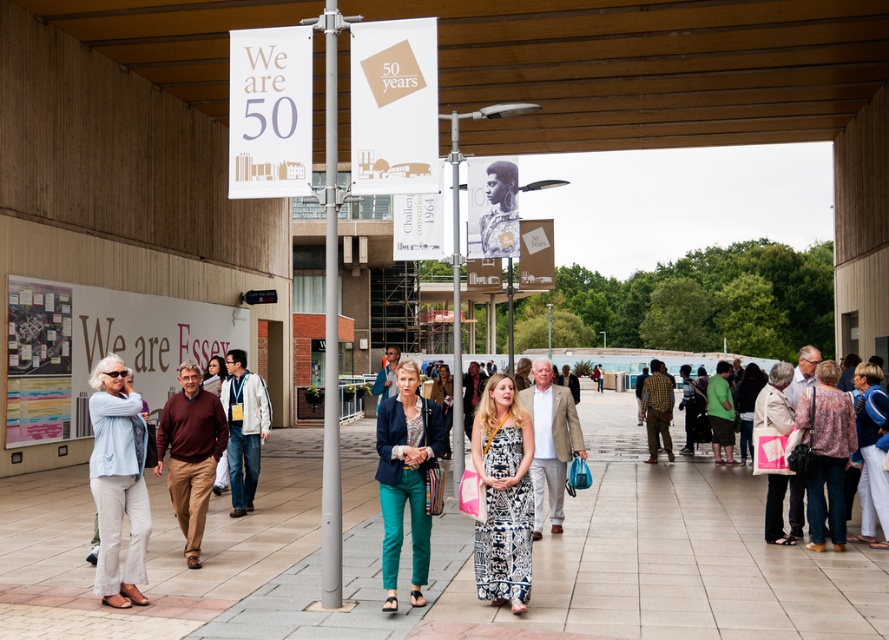
Between light blue denim jacket at lower left and maroon sweater at center, which one appears on the left side from the viewer's perspective?

From the viewer's perspective, light blue denim jacket at lower left appears more on the left side.

Does light blue denim jacket at lower left appear under maroon sweater at center?

Incorrect, light blue denim jacket at lower left is not positioned below maroon sweater at center.

Where is `light blue denim jacket at lower left`? Image resolution: width=889 pixels, height=640 pixels. light blue denim jacket at lower left is located at coordinates (118, 481).

Measure the distance between smooth concrete pavement at center and silver metallic pole at center.

A distance of 11.01 feet exists between smooth concrete pavement at center and silver metallic pole at center.

Who is positioned more to the right, smooth concrete pavement at center or silver metallic pole at center?

Positioned to the right is smooth concrete pavement at center.

Measure the distance between point (x=453, y=618) and camera.

They are 7.23 meters apart.

Locate an element on the screen. Image resolution: width=889 pixels, height=640 pixels. smooth concrete pavement at center is located at coordinates (447, 556).

Can you confirm if teal fabric pants at center is wider than beige fabric handbag at lower right?

Correct, the width of teal fabric pants at center exceeds that of beige fabric handbag at lower right.

Who is higher up, teal fabric pants at center or beige fabric handbag at lower right?

Positioned higher is beige fabric handbag at lower right.

Does point (397, 454) come in front of point (775, 515)?

Yes, it is in front of point (775, 515).

What are the coordinates of `teal fabric pants at center` in the screenshot? It's located at (405, 477).